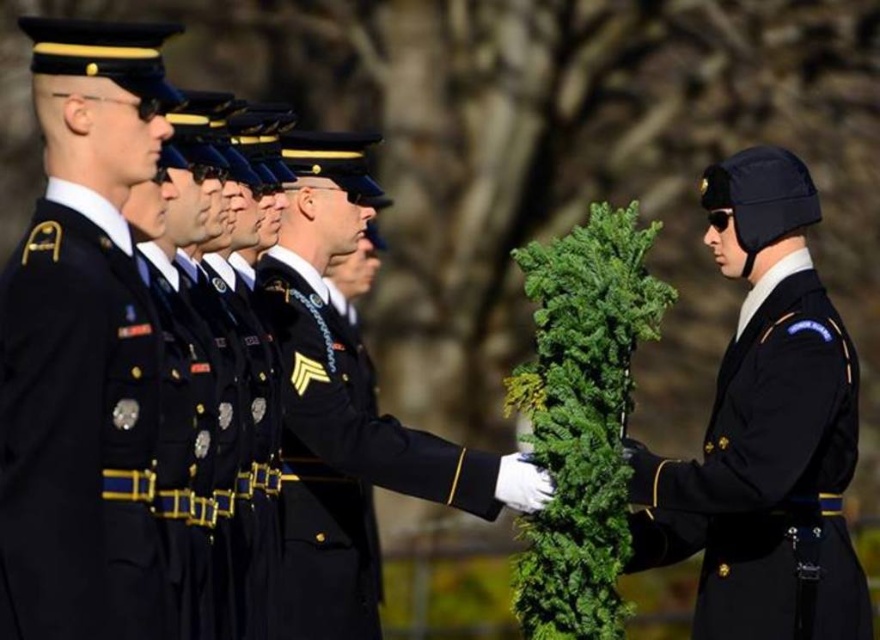
You are a photographer at the military ceremony. You want to capture a closeup shot of the dark blue woolen uniform at center. Where should you aim your camera?

You should aim your camera at point (77, 429) to capture the dark blue woolen uniform at center.